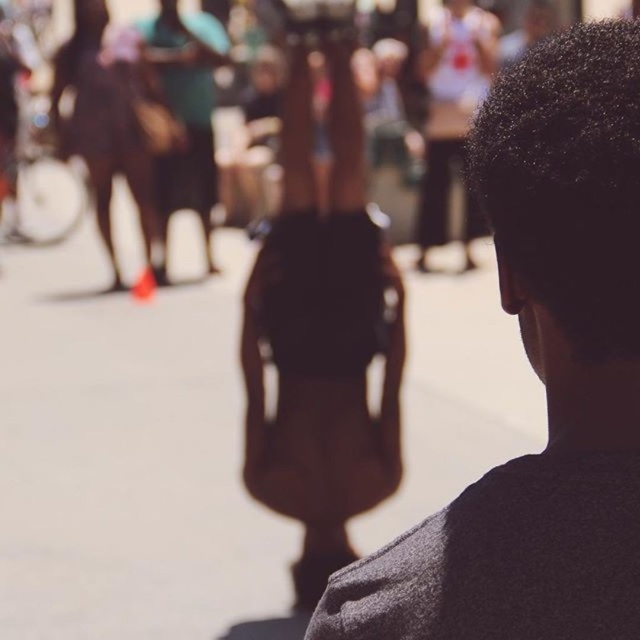
Question: Which object is closer to the camera taking this photo?

Choices:
 (A) dark gray sweater at center
 (B) brown leather bag at center

Answer: (A)

Question: Can you confirm if dark gray sweater at center is thinner than brown leather bag at center?

Choices:
 (A) no
 (B) yes

Answer: (B)

Question: Does dark gray sweater at center appear on the right side of brown leather bag at center?

Choices:
 (A) no
 (B) yes

Answer: (B)

Question: Which point is closer to the camera?

Choices:
 (A) (364, 467)
 (B) (552, 417)

Answer: (B)

Question: Which of the following is the farthest from the observer?

Choices:
 (A) brown leather bag at center
 (B) dark gray sweater at center

Answer: (A)

Question: Can you confirm if dark gray sweater at center is positioned above brown leather bag at center?

Choices:
 (A) no
 (B) yes

Answer: (A)